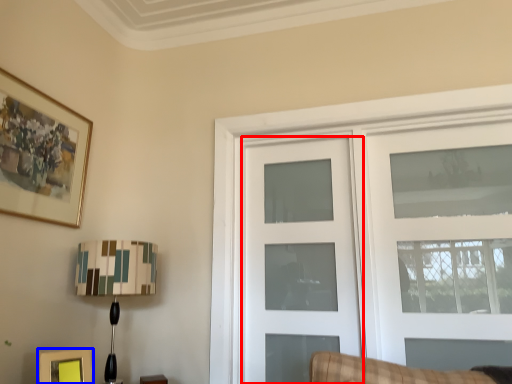
Question: Which of the following is the closest to the observer, door (highlighted by a red box) or picture frame (highlighted by a blue box)?

Choices:
 (A) door
 (B) picture frame

Answer: (B)